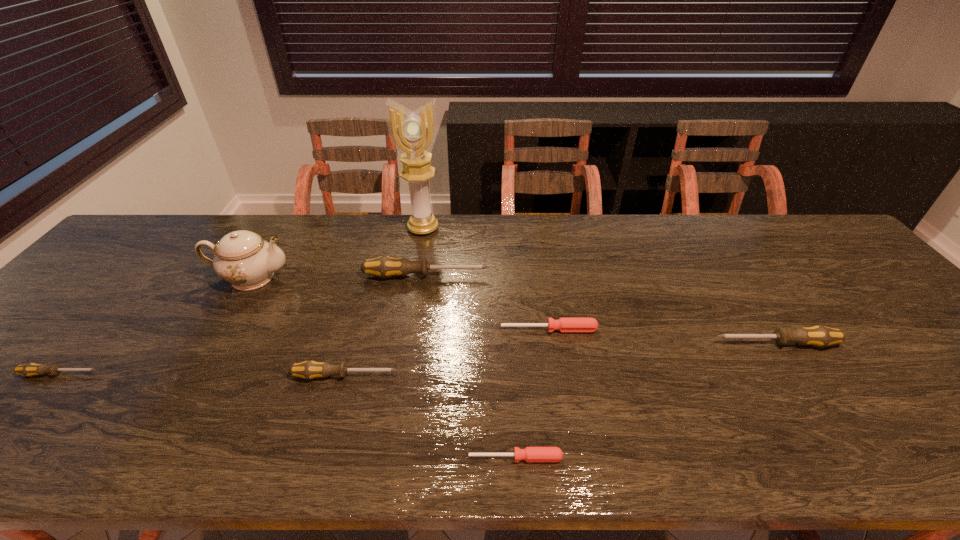
Identify the location of the bigger red screwdriver. Image resolution: width=960 pixels, height=540 pixels. pos(563,324).

I want to click on the second farthest screwdriver, so click(x=563, y=324).

The width and height of the screenshot is (960, 540). Find the location of `the leftmost gray screwdriver`. the leftmost gray screwdriver is located at coordinates (31, 369).

This screenshot has width=960, height=540. I want to click on the smallest gray screwdriver, so click(x=31, y=369).

This screenshot has height=540, width=960. Identify the location of the smaller red screwdriver. (530, 454).

The image size is (960, 540). In order to click on the shortest object in this screenshot , I will do `click(530, 454)`.

Locate an element on the screen. vacant area situated 0.150m on the front-facing side of the farthest object is located at coordinates (417, 268).

Identify the location of free space located at the spout of the second tallest object. (331, 278).

Identify the location of free space located at the tip of the farthest screwdriver. The height and width of the screenshot is (540, 960). (591, 276).

Where is `free space located at the tip of the fifth farthest object`? The image size is (960, 540). free space located at the tip of the fifth farthest object is located at coordinates (606, 343).